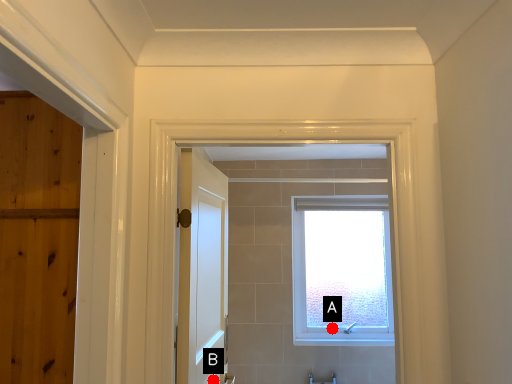
Question: Two points are circled on the image, labeled by A and B beside each circle. Which point appears closest to the camera in this image?

Choices:
 (A) A is closer
 (B) B is closer

Answer: (B)